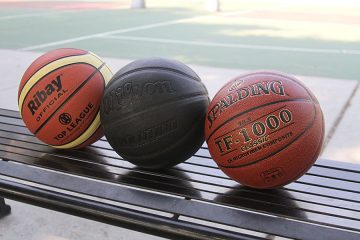
Image resolution: width=360 pixels, height=240 pixels. In order to click on bench in this screenshot , I will do `click(325, 197)`.